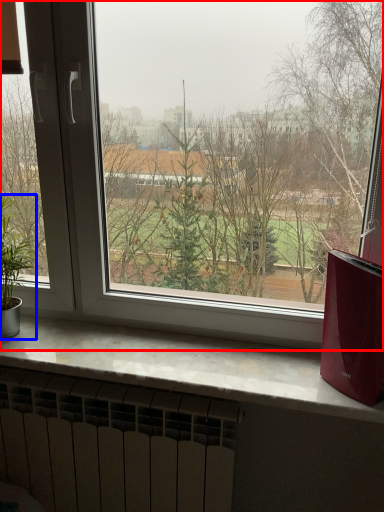
Question: Among these objects, which one is nearest to the camera, window (highlighted by a red box) or houseplant (highlighted by a blue box)?

Choices:
 (A) window
 (B) houseplant

Answer: (A)